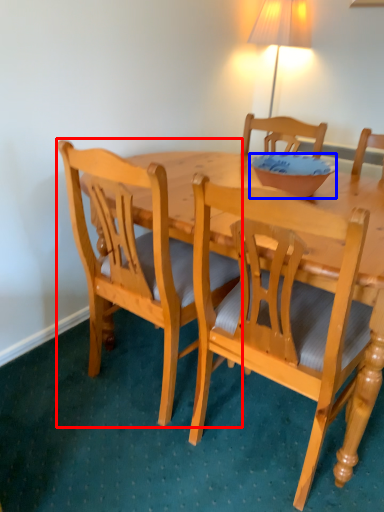
Question: Among these objects, which one is nearest to the camera, chair (highlighted by a red box) or bowl (highlighted by a blue box)?

Choices:
 (A) chair
 (B) bowl

Answer: (A)